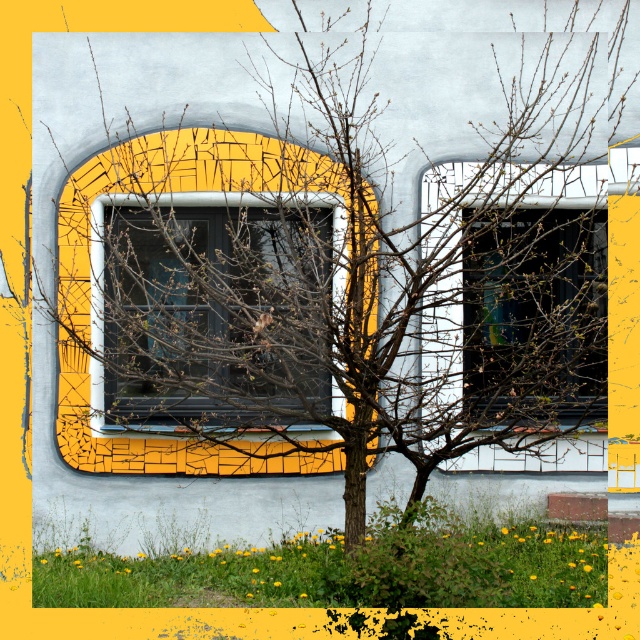
From the picture: Is matte glass window at center wider than transparent glass window at center?

Correct, the width of matte glass window at center exceeds that of transparent glass window at center.

Between matte glass window at center and transparent glass window at center, which one has less height?

Standing shorter between the two is transparent glass window at center.

Identify the location of matte glass window at center. (212, 310).